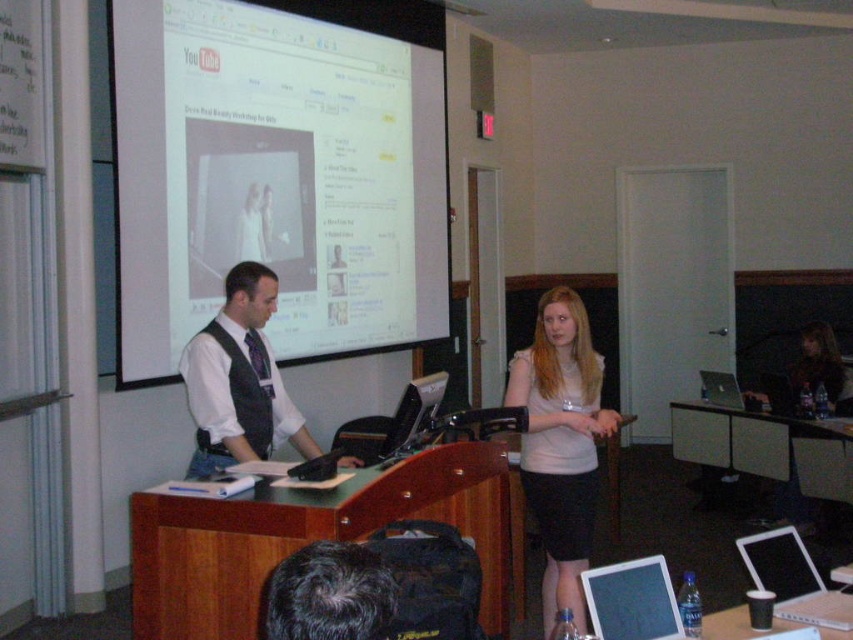
You are a student in the classroom and want to locate the matte black vest at center. Where exactly is it positioned in the image?

The matte black vest at center is positioned at coordinates point 0.594 on the x axis and point 0.281 on the y axis.

You are standing in the classroom and want to take a photo of the point at coordinates point (299, 440). The camera you are using has a focal length of 50mm and a sensor size of 24mm. What is the minimum distance you need to move forward or backward to ensure the point is within the camera frame?

The point (299, 440) is 11.88 feet from the camera. To ensure it is within the frame, you must position yourself so that the camera is at least 11.88 feet away from the point. Since the sensor size and focal length determine the field of view, calculating the exact distance requires knowing the angle of view. However, based on the given distance, maintaining the current position or moving slightly further back would keep the point within the frame.

You are a student sitting in the back row of the classroom. You need to present your project using both the white glossy projection screen at upper center and the silver metallic laptop at center. Which object should you place first to ensure your presentation starts smoothly?

The white glossy projection screen at upper center should be placed first because it is much taller than the silver metallic laptop at center, ensuring it can be positioned at an appropriate height for the audience to view the presentation comfortably.